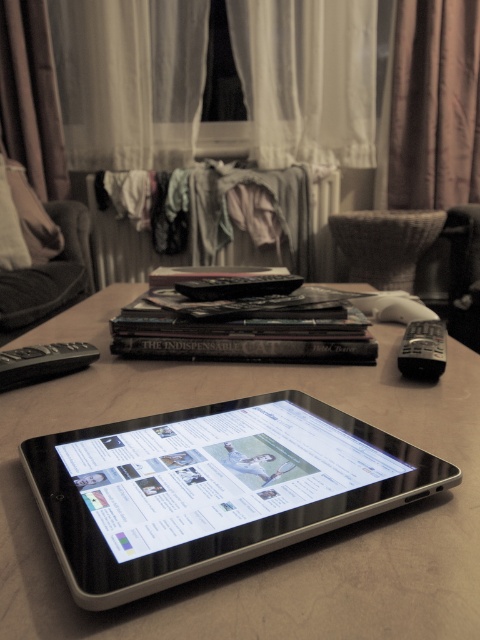
Question: Which point appears closest to the camera in this image?

Choices:
 (A) (395, 378)
 (B) (420, 337)

Answer: (A)

Question: Can you confirm if black plastic remote at center is wider than black plastic remote at right?

Choices:
 (A) no
 (B) yes

Answer: (B)

Question: Can you confirm if black plastic remote at left is thinner than black plastic remote at center?

Choices:
 (A) no
 (B) yes

Answer: (B)

Question: Which object is closer to the camera taking this photo?

Choices:
 (A) black plastic remote at left
 (B) black plastic remote at center
 (C) black plastic remote at right

Answer: (A)

Question: Which point is closer to the camera taking this photo?

Choices:
 (A) (191, 285)
 (B) (406, 336)
 (C) (24, 362)

Answer: (C)

Question: Considering the relative positions of black plastic remote at center and black plastic remote at right in the image provided, where is black plastic remote at center located with respect to black plastic remote at right?

Choices:
 (A) below
 (B) above

Answer: (B)